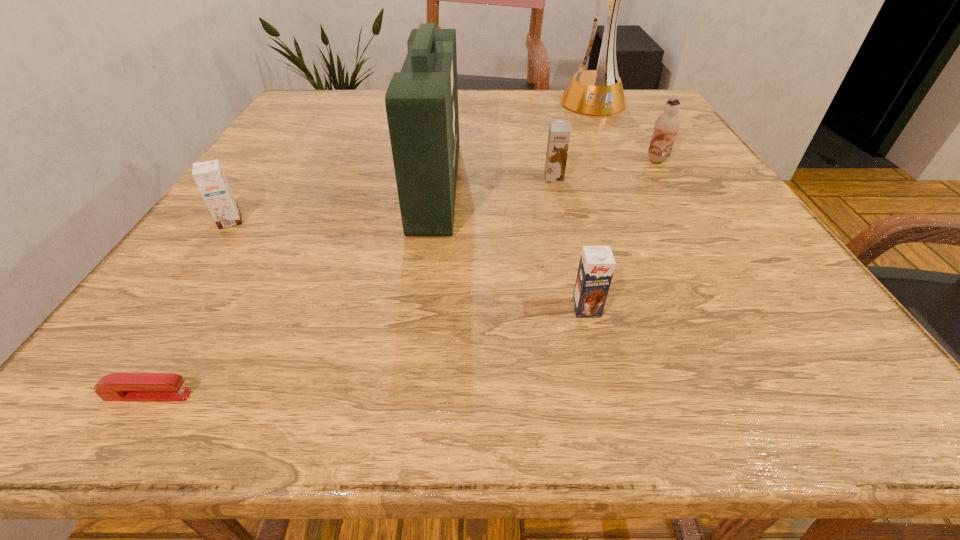
At what (x,y) coordinates should I click in order to perform the action: click on the tallest object. Please return your answer as a coordinate pair (x, y). Looking at the image, I should click on (599, 92).

Where is `trophy`? Image resolution: width=960 pixels, height=540 pixels. trophy is located at coordinates (599, 92).

Locate an element on the screen. This screenshot has width=960, height=540. the first-aid kit is located at coordinates (421, 101).

This screenshot has width=960, height=540. I want to click on the third object from left to right, so click(421, 101).

I want to click on the rightmost chocolate milk, so coord(666,127).

At what (x,y) coordinates should I click in order to perform the action: click on the second farthest chocolate milk. Please return your answer as a coordinate pair (x, y). The height and width of the screenshot is (540, 960). Looking at the image, I should click on (559, 133).

Find the location of a particular element. Image resolution: width=960 pixels, height=540 pixels. the leftmost chocolate milk is located at coordinates (209, 176).

Where is `the sixth farthest object`? the sixth farthest object is located at coordinates [597, 263].

The height and width of the screenshot is (540, 960). Identify the location of the shortest object. (117, 386).

This screenshot has width=960, height=540. Identify the location of the nearest object. (117, 386).